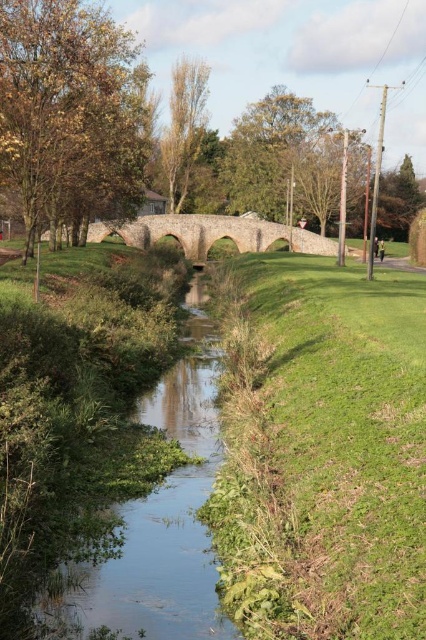
Does green grass at center come in front of green grassy stream at center?

Yes, green grass at center is closer to the viewer.

Does point (221, 529) come closer to viewer compared to point (175, 369)?

Yes, it is in front of point (175, 369).

Identify the location of green grass at center. The height and width of the screenshot is (640, 426). (321, 451).